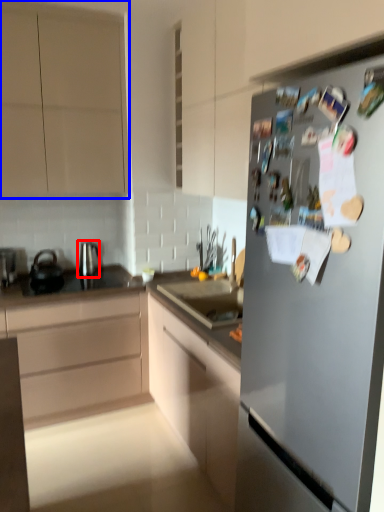
Question: Which object is further to the camera taking this photo, tea pot (highlighted by a red box) or cabinetry (highlighted by a blue box)?

Choices:
 (A) tea pot
 (B) cabinetry

Answer: (A)